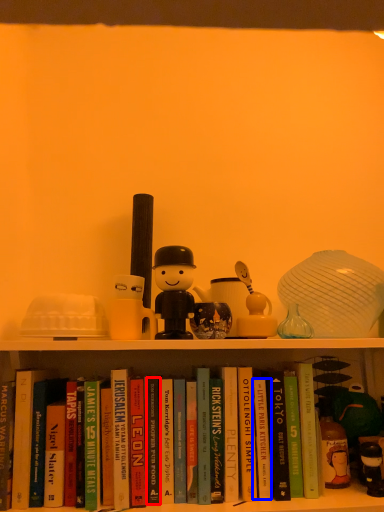
Question: Among these objects, which one is nearest to the camera, paperback book (highlighted by a red box) or paperback book (highlighted by a blue box)?

Choices:
 (A) paperback book
 (B) paperback book

Answer: (A)